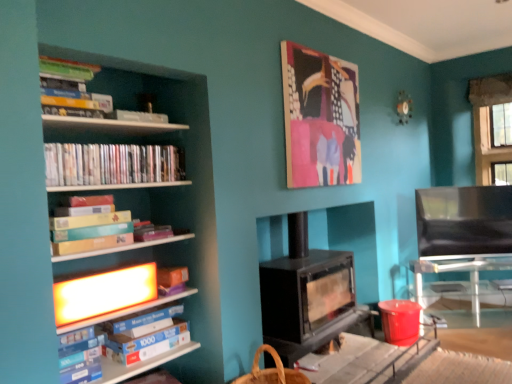
Question: Is canvas painting at upper center wider or thinner than black matte wood burning stove at center?

Choices:
 (A) wide
 (B) thin

Answer: (B)

Question: Choose the correct answer: Is canvas painting at upper center inside black matte wood burning stove at center or outside it?

Choices:
 (A) inside
 (B) outside

Answer: (B)

Question: Which object is positioned closest to the blue cardboard box at left?

Choices:
 (A) black matte wood burning stove at center
 (B) clear glass table at lower right
 (C) black leather armchair at right
 (D) blue cardboard box at left, the 3th book from the top
 (E) matte cardboard book at left, which is counted as the second book, starting from the bottom

Answer: (D)

Question: Considering the real-world distances, which object is closest to the clear glass table at lower right?

Choices:
 (A) black matte wood burning stove at center
 (B) white glossy shelves at left
 (C) black leather armchair at right
 (D) blue cardboard box at left
 (E) matte plastic dvds at left, the 3th book in the bottom-to-top sequence

Answer: (C)